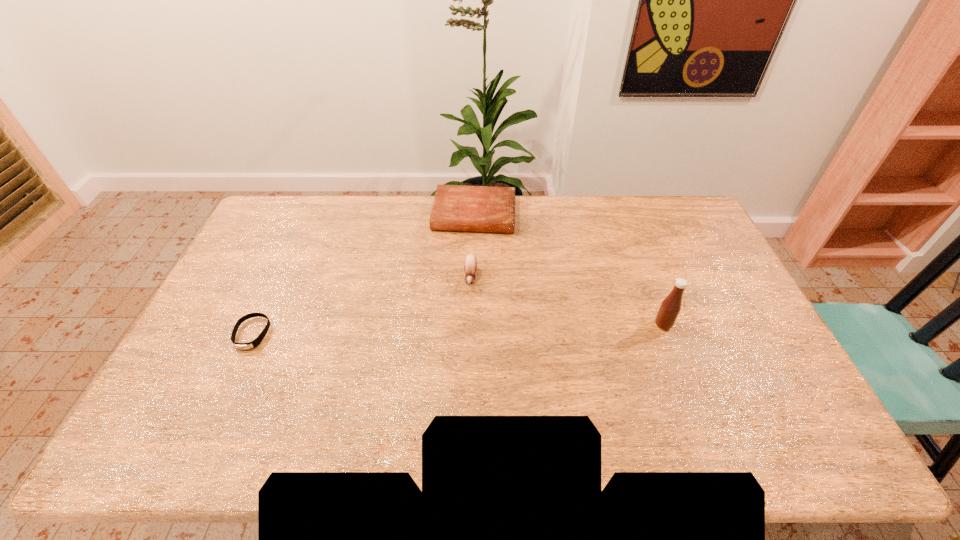
In the image, there is a desktop. Find the location of `vacant space at the left edge`. vacant space at the left edge is located at coordinates (261, 299).

The height and width of the screenshot is (540, 960). In order to click on vacant area at the right edge of the desktop in this screenshot , I will do `click(692, 274)`.

This screenshot has height=540, width=960. I want to click on vacant space at the far left corner, so click(x=304, y=217).

Locate an element on the screen. unoccupied position between the tallest object and the Bible is located at coordinates (568, 269).

I want to click on free space between the escargot and the tallest object, so click(x=566, y=301).

What are the coordinates of `free area in between the farthest object and the shortest object` in the screenshot? It's located at (363, 274).

Find the location of a particular element. This screenshot has height=540, width=960. vacant space that's between the leftmost object and the Tabasco sauce is located at coordinates (458, 329).

You are a GUI agent. You are given a task and a screenshot of the screen. Output one action in this format:
    pyautogui.click(x=<x>, y=<y>)
    Task: Click on the free space between the second shortest object and the third nearest object
    The width and height of the screenshot is (960, 540).
    Given the screenshot: What is the action you would take?
    pyautogui.click(x=472, y=246)

Identify the location of free spot between the farthest object and the wristband. This screenshot has width=960, height=540. [x=363, y=274].

Locate an element on the screen. The image size is (960, 540). empty location between the rightmost object and the shortest object is located at coordinates (458, 329).